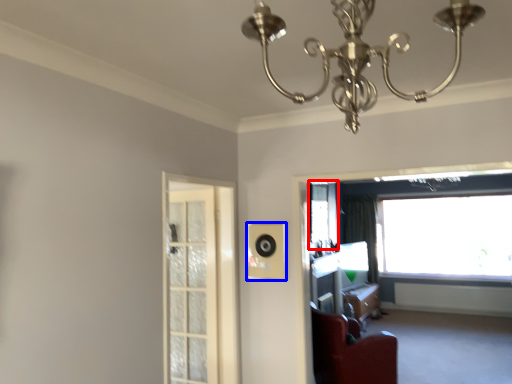
Question: Which point is closer to the camera, window screen (highlighted by a red box) or speaker (highlighted by a blue box)?

Choices:
 (A) window screen
 (B) speaker

Answer: (B)